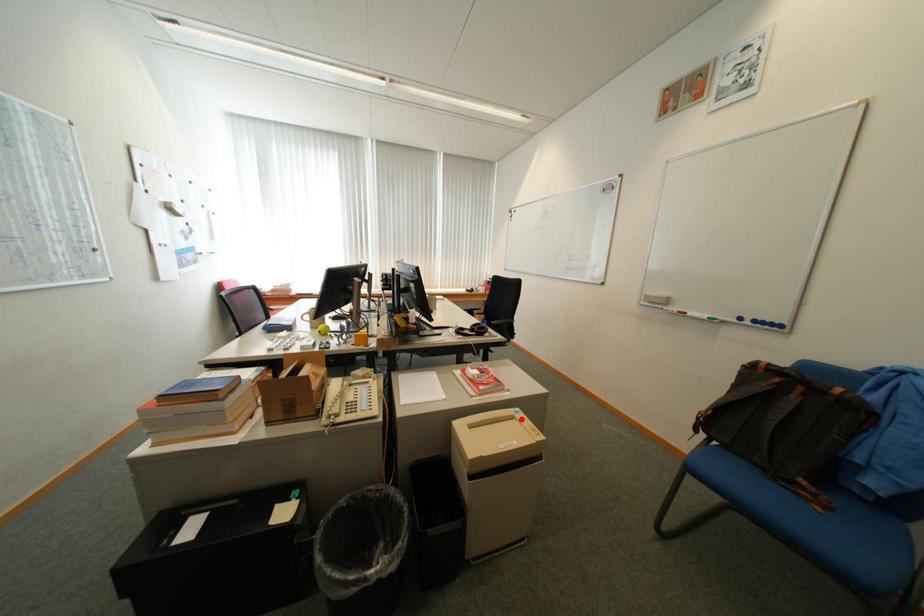
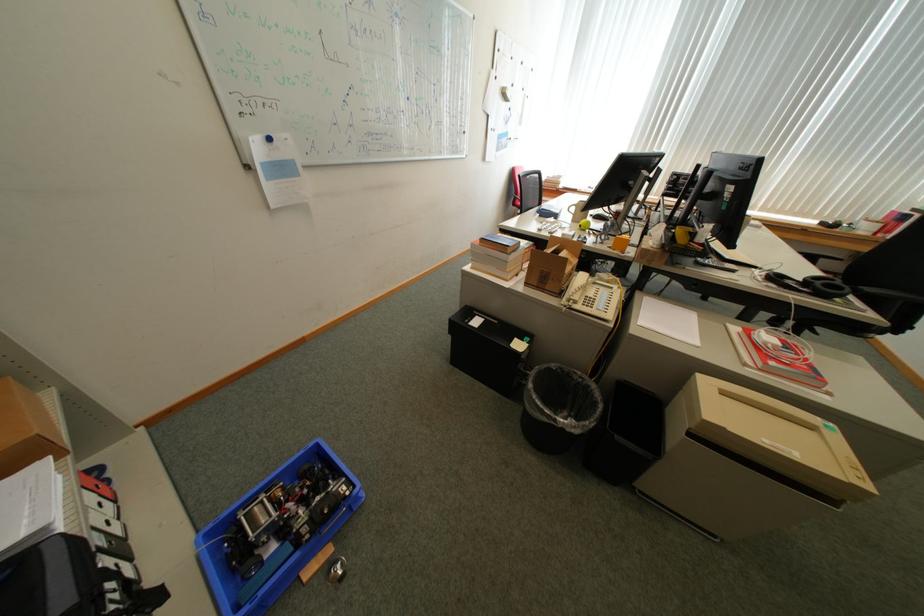
In the second image, find the point that corresponds to the highlighted location in the first image.

(820, 428)